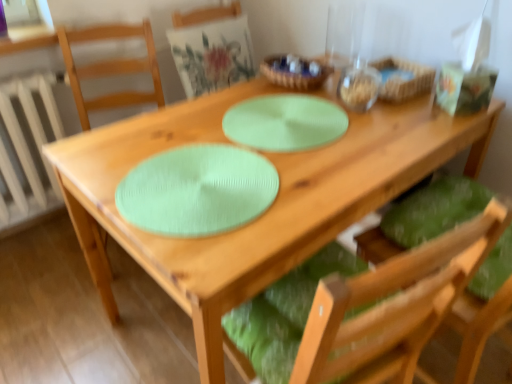
Find the location of a particular element. free space above mint green textured placemat at center (from a real-world perspective) is located at coordinates (200, 178).